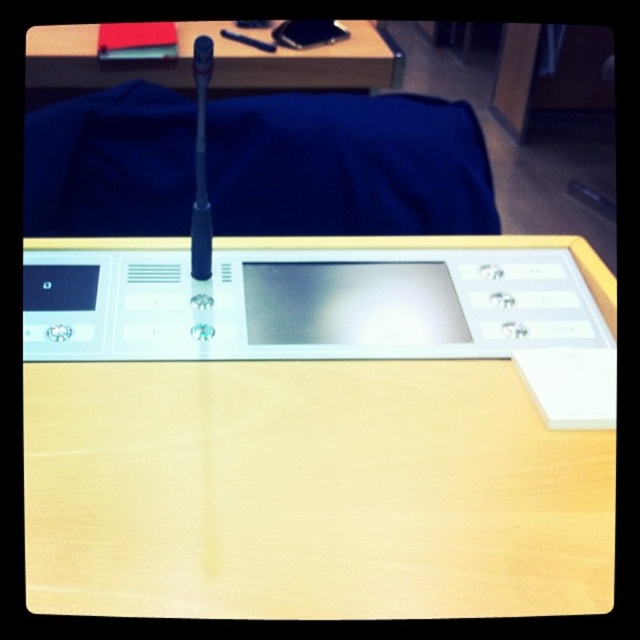
From the picture: Is blue fabric at center bigger than satin silver tablet at center?

Correct, blue fabric at center is larger in size than satin silver tablet at center.

What do you see at coordinates (348, 164) in the screenshot?
I see `blue fabric at center` at bounding box center [348, 164].

Does point (433, 120) lie behind point (268, 340)?

That is True.

The height and width of the screenshot is (640, 640). Find the location of `blue fabric at center`. blue fabric at center is located at coordinates (348, 164).

Is light wood table at center shorter than blue fabric at center?

No.

Does light wood table at center come in front of blue fabric at center?

That is True.

Which is behind, point (451, 516) or point (214, 220)?

The point (214, 220) is more distant.

You are a GUI agent. You are given a task and a screenshot of the screen. Output one action in this format:
    pyautogui.click(x=<x>, y=<y>)
    Task: Click on the light wood table at center
    The width and height of the screenshot is (640, 640).
    Given the screenshot: What is the action you would take?
    pyautogui.click(x=310, y=428)

Does point (90, 426) come in front of point (262, 294)?

Yes.

This screenshot has width=640, height=640. I want to click on light wood table at center, so click(310, 428).

This screenshot has height=640, width=640. In order to click on light wood table at center in this screenshot , I will do `click(310, 428)`.